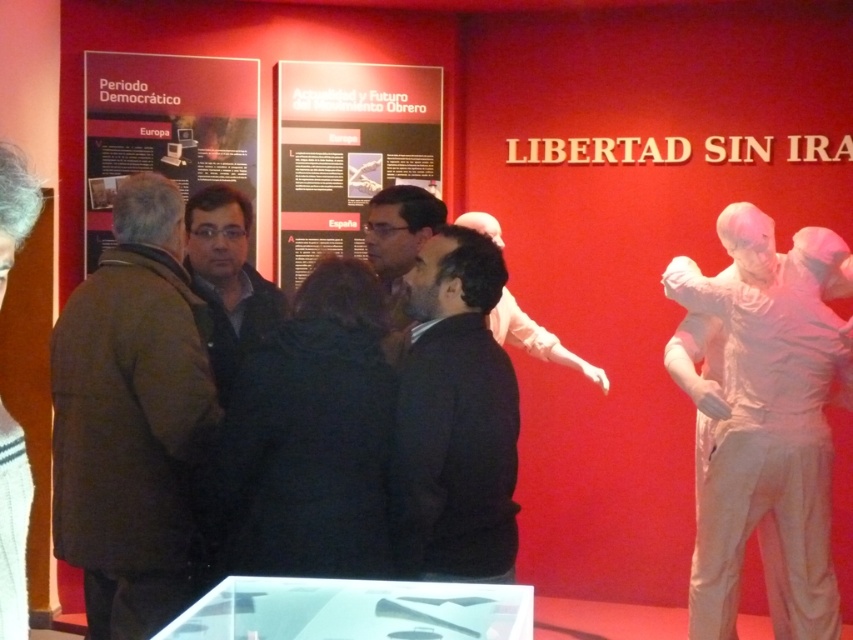
Does matte black poster at left appear on the right side of dark gray jacket at center?

No, matte black poster at left is not to the right of dark gray jacket at center.

Between point (193, 138) and point (369, 253), which one is positioned in front?

Positioned in front is point (369, 253).

The image size is (853, 640). What are the coordinates of `matte black poster at left` in the screenshot? It's located at (165, 125).

Between matte black jacket at center and dark gray jacket at center, which one is positioned lower?

dark gray jacket at center is lower down.

Is matte black jacket at center above dark gray jacket at center?

Yes.

Does point (241, 284) come closer to viewer compared to point (514, 307)?

Yes.

Identify the location of matte black jacket at center. (227, 276).

Can you confirm if matte black poster at center is positioned to the right of dark gray jacket at center?

Incorrect, matte black poster at center is not on the right side of dark gray jacket at center.

Does point (334, 157) lie in front of point (506, 324)?

No, it is not.

Is point (376, 116) more distant than point (558, 342)?

Yes, point (376, 116) is farther from viewer.

Locate an element on the screen. The image size is (853, 640). matte black poster at center is located at coordinates (347, 150).